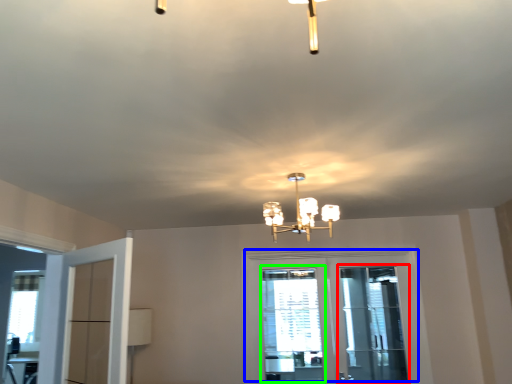
Question: Considering the real-world distances, which object is farthest from screen door (highlighted by a red box)? door (highlighted by a blue box) or window (highlighted by a green box)?

Choices:
 (A) door
 (B) window

Answer: (B)